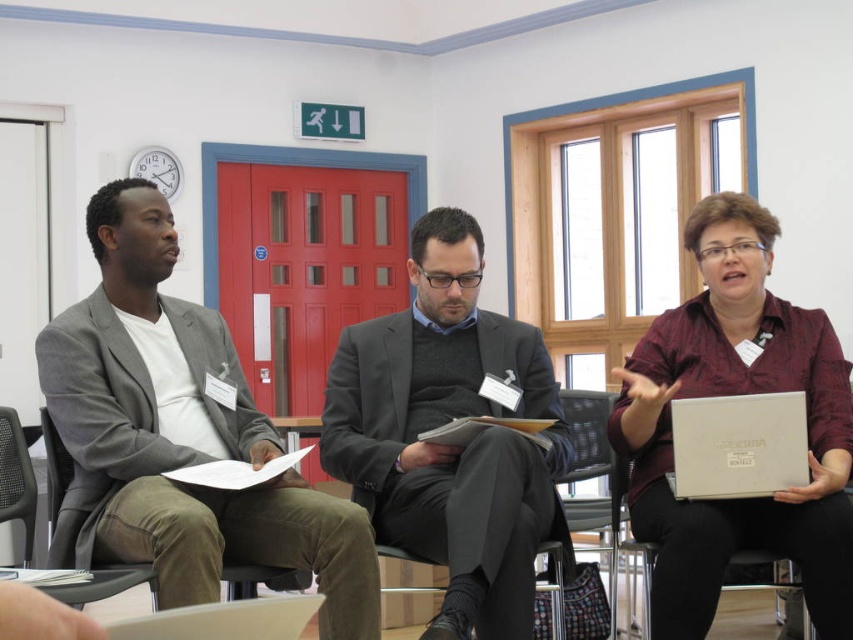
You are sitting in the black mesh chair at left and want to hand a document to the person in the dark gray fabric chair at left. Can you reach them without leaving your seat?

The dark gray fabric chair at left is in front of the black mesh chair at left, so you can reach them without leaving your seat.

Looking at this image, you are standing in the conference room and need to sit down. The dark gray fabric chair at left is represented by point [54,472]. Is the chair closer to the red door or the blue window?

The dark gray fabric chair at left is represented by point [54,472], which is closer to the blue window than the red door.